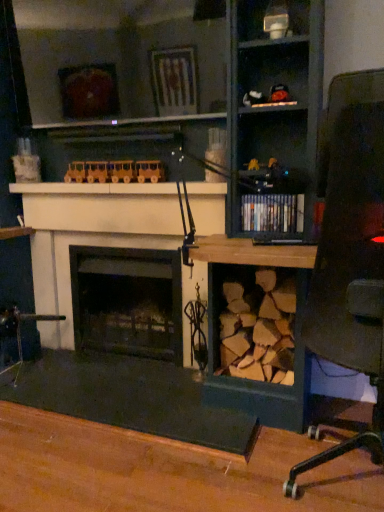
This screenshot has height=512, width=384. In order to click on free space in front of white matte fireplace at center, positioned as the 1th fireplace in front-to-back order in this screenshot , I will do `click(103, 452)`.